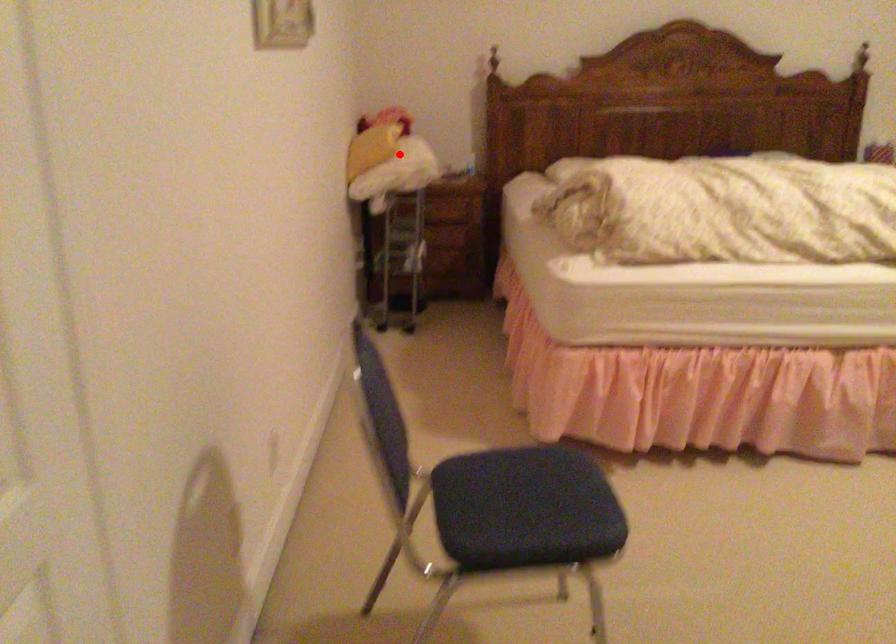
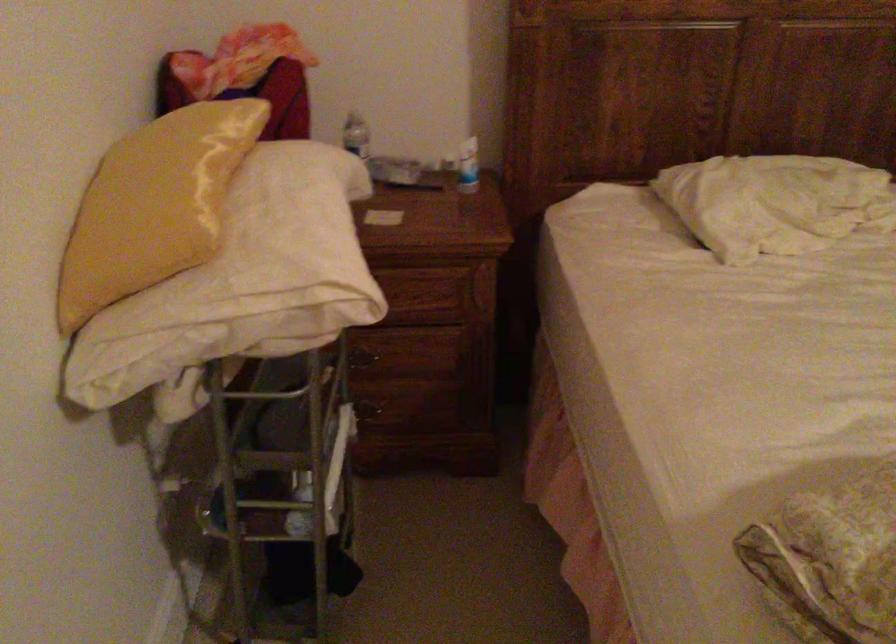
Question: I am providing you with two images of the same scene from different viewpoints. In image1, a red point is highlighted. Considering the same 3D point in image2, which of the following is correct?

Choices:
 (A) It is closer
 (B) It is farther

Answer: (A)